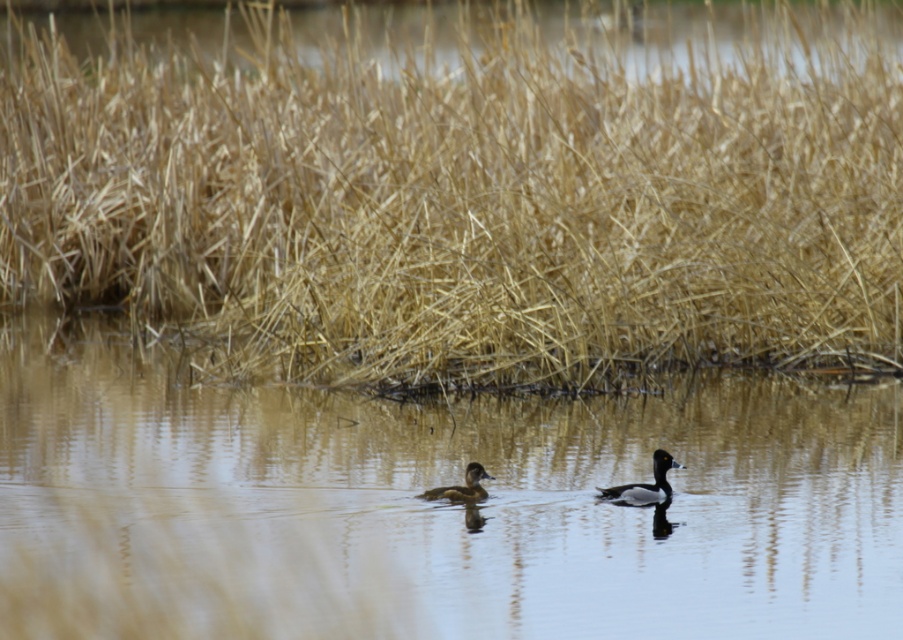
Which of these two, clear water at center or brown speckled duck at center, stands shorter?

brown speckled duck at center is shorter.

Which is above, clear water at center or brown speckled duck at center?

Positioned higher is clear water at center.

This screenshot has height=640, width=903. Identify the location of clear water at center. (433, 506).

Where is `clear water at center`? The height and width of the screenshot is (640, 903). clear water at center is located at coordinates (433, 506).

Does brown dry grass at upper center appear under brown speckled duck at center?

Incorrect, brown dry grass at upper center is not positioned below brown speckled duck at center.

Which is more to the right, brown dry grass at upper center or brown speckled duck at center?

brown speckled duck at center is more to the right.

Which is in front, point (511, 234) or point (644, 488)?

Point (644, 488) is in front.

Locate an element on the screen. brown dry grass at upper center is located at coordinates (464, 205).

Can you confirm if brown dry grass at upper center is positioned above brown glossy duck at center?

Yes.

Consider the image. Between brown dry grass at upper center and brown glossy duck at center, which one is positioned higher?

brown dry grass at upper center

Between point (757, 132) and point (473, 481), which one is positioned in front?

Point (473, 481) is more forward.

You are a GUI agent. You are given a task and a screenshot of the screen. Output one action in this format:
    pyautogui.click(x=<x>, y=<y>)
    Task: Click on the brown dry grass at upper center
    The width and height of the screenshot is (903, 640).
    Given the screenshot: What is the action you would take?
    pyautogui.click(x=464, y=205)